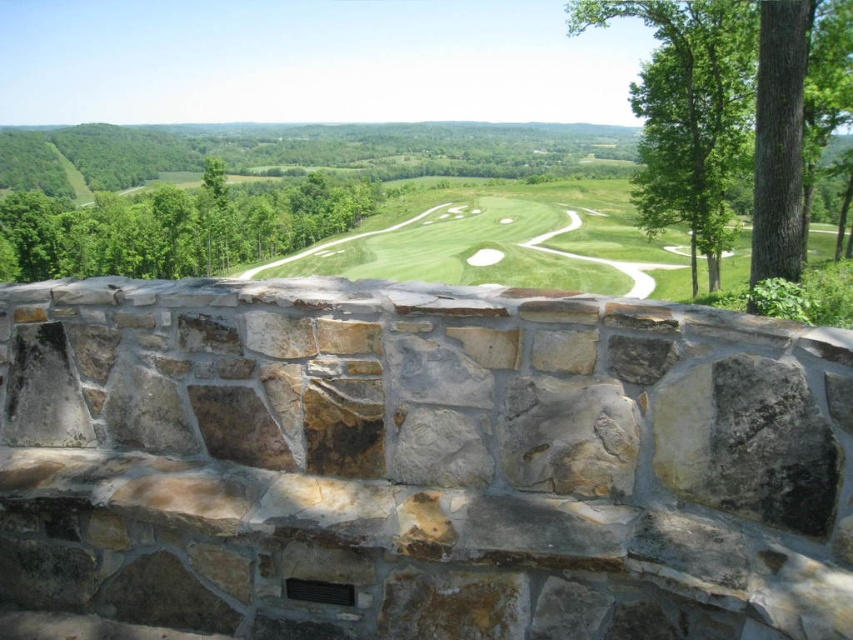
Between green leafy tree at right and green grassy golf course at center, which one has more height?

green grassy golf course at center

Does green leafy tree at right have a smaller size compared to green grassy golf course at center?

Indeed, green leafy tree at right has a smaller size compared to green grassy golf course at center.

Is point (709, 115) positioned in front of point (415, 272)?

Yes, point (709, 115) is closer to viewer.

The width and height of the screenshot is (853, 640). Identify the location of green leafy tree at right. (730, 113).

Does green grassy golf course at center appear on the left side of metallic gray vent at lower center?

In fact, green grassy golf course at center is to the right of metallic gray vent at lower center.

Who is more forward, (403, 225) or (305, 596)?

Positioned in front is point (305, 596).

Find the location of `green grassy golf course at center`. green grassy golf course at center is located at coordinates (506, 240).

Does natural stone bench at center appear on the right side of metallic gray vent at lower center?

No, natural stone bench at center is not to the right of metallic gray vent at lower center.

Who is shorter, natural stone bench at center or metallic gray vent at lower center?

Standing shorter between the two is metallic gray vent at lower center.

This screenshot has height=640, width=853. Describe the element at coordinates (422, 461) in the screenshot. I see `natural stone bench at center` at that location.

Find the location of a particular element. The width and height of the screenshot is (853, 640). natural stone bench at center is located at coordinates (422, 461).